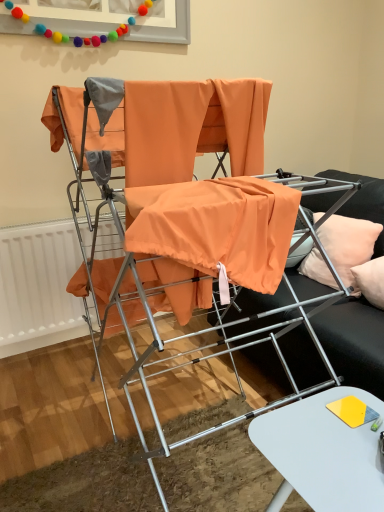
Question: Is white glossy table at lower right not close to orange fabric at center?

Choices:
 (A) no
 (B) yes

Answer: (A)

Question: Is white glossy table at lower right surrounding orange fabric at center?

Choices:
 (A) yes
 (B) no

Answer: (B)

Question: Is white glossy table at lower right shorter than orange fabric at center?

Choices:
 (A) no
 (B) yes

Answer: (B)

Question: From the image's perspective, is white glossy table at lower right on top of orange fabric at center?

Choices:
 (A) yes
 (B) no

Answer: (B)

Question: Are white glossy table at lower right and orange fabric at center making contact?

Choices:
 (A) yes
 (B) no

Answer: (B)

Question: From a real-world perspective, is white glossy table at lower right positioned under orange fabric at center based on gravity?

Choices:
 (A) no
 (B) yes

Answer: (B)

Question: Is peach fabric pillow at right taller than white glossy table at lower right?

Choices:
 (A) yes
 (B) no

Answer: (B)

Question: Does peach fabric pillow at right have a lesser width compared to white glossy table at lower right?

Choices:
 (A) no
 (B) yes

Answer: (B)

Question: Can you confirm if peach fabric pillow at right is smaller than white glossy table at lower right?

Choices:
 (A) no
 (B) yes

Answer: (B)

Question: Is the depth of peach fabric pillow at right less than that of white glossy table at lower right?

Choices:
 (A) no
 (B) yes

Answer: (A)

Question: Considering the relative sizes of peach fabric pillow at right and white glossy table at lower right in the image provided, is peach fabric pillow at right wider than white glossy table at lower right?

Choices:
 (A) yes
 (B) no

Answer: (B)

Question: From a real-world perspective, is peach fabric pillow at right under white glossy table at lower right?

Choices:
 (A) yes
 (B) no

Answer: (B)

Question: Is white glossy table at lower right facing towards peach fabric pillow at right?

Choices:
 (A) yes
 (B) no

Answer: (B)